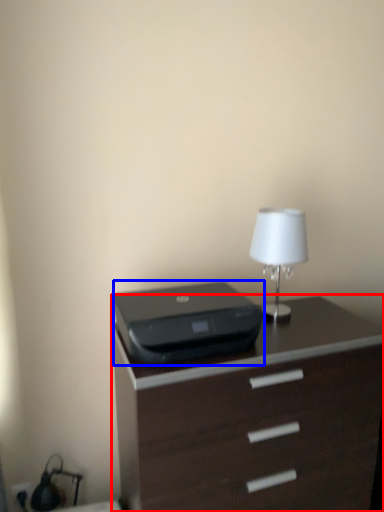
Question: Among these objects, which one is farthest to the camera, chest of drawers (highlighted by a red box) or printer (highlighted by a blue box)?

Choices:
 (A) chest of drawers
 (B) printer

Answer: (B)